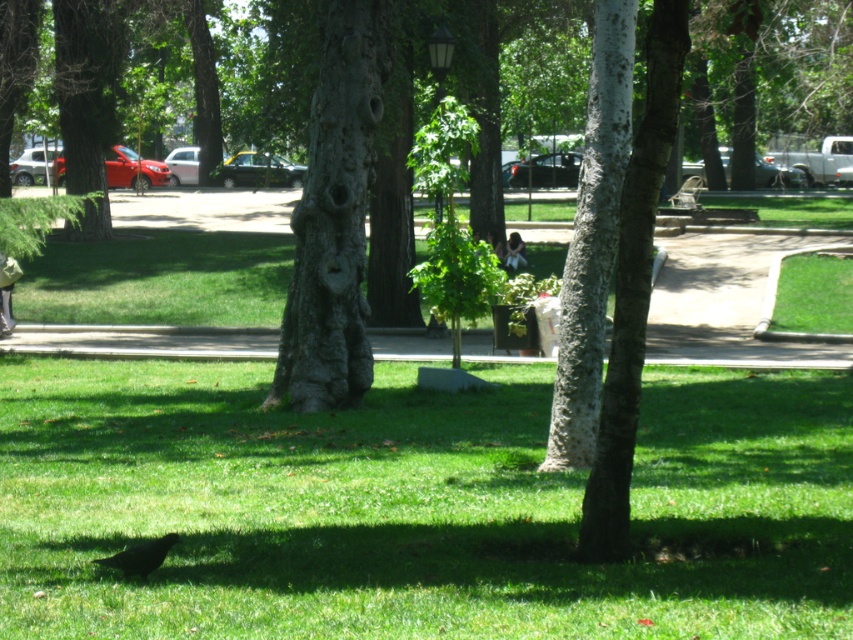
Can you confirm if shiny black bird at lower left is positioned below metallic silver bench at center?

Yes, shiny black bird at lower left is below metallic silver bench at center.

Which is more to the right, shiny black bird at lower left or metallic silver bench at center?

From the viewer's perspective, metallic silver bench at center appears more on the right side.

What do you see at coordinates (140, 556) in the screenshot? The height and width of the screenshot is (640, 853). I see `shiny black bird at lower left` at bounding box center [140, 556].

The width and height of the screenshot is (853, 640). Find the location of `shiny black bird at lower left`. shiny black bird at lower left is located at coordinates (140, 556).

You are a GUI agent. You are given a task and a screenshot of the screen. Output one action in this format:
    pyautogui.click(x=<x>, y=<y>)
    Task: Click on the green grassy at center
    This screenshot has width=853, height=640.
    Given the screenshot: What is the action you would take?
    pyautogui.click(x=415, y=508)

Identify the location of green grassy at center. Image resolution: width=853 pixels, height=640 pixels. tap(415, 508).

Which is in front, point (577, 371) or point (160, 540)?

Positioned in front is point (160, 540).

Which of these two, white textured tree trunk at center or shiny black bird at lower left, stands taller?

Standing taller between the two is white textured tree trunk at center.

Find the location of a particular element. Image resolution: width=853 pixels, height=640 pixels. white textured tree trunk at center is located at coordinates (592, 240).

The height and width of the screenshot is (640, 853). I want to click on white textured tree trunk at center, so click(x=592, y=240).